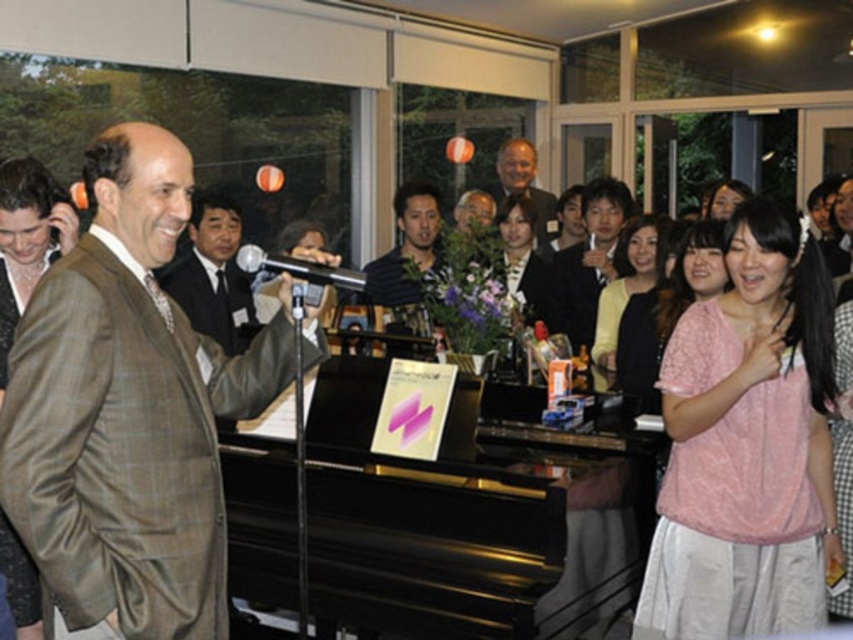
You are a photographer at the event and want to capture both the brown checkered suit at left and the matte brown jacket at left in a single shot. Which one should you focus on to ensure both are in frame without moving the camera?

The brown checkered suit at left is much taller than the matte brown jacket at left, so focusing on the taller one will ensure both are in frame.

You are a photographer at this event and want to capture a portrait of the person at the center. Since you can only focus on one subject, will the matte black hair at center be in focus if you focus on the light brown suit at center?

The matte black hair at center is located below the light brown suit at center, so focusing on the light brown suit at center will also keep the matte black hair at center in focus since they are part of the same subject.